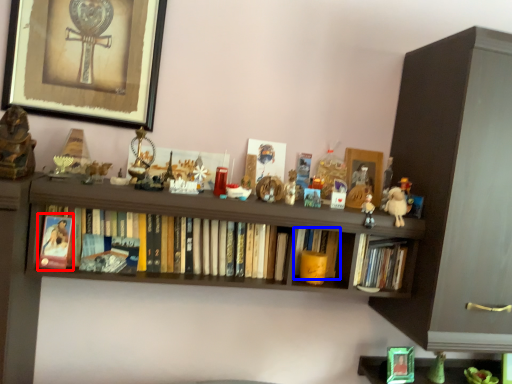
Question: Among these objects, which one is farthest to the camera, paperback book (highlighted by a red box) or book (highlighted by a blue box)?

Choices:
 (A) paperback book
 (B) book

Answer: (B)